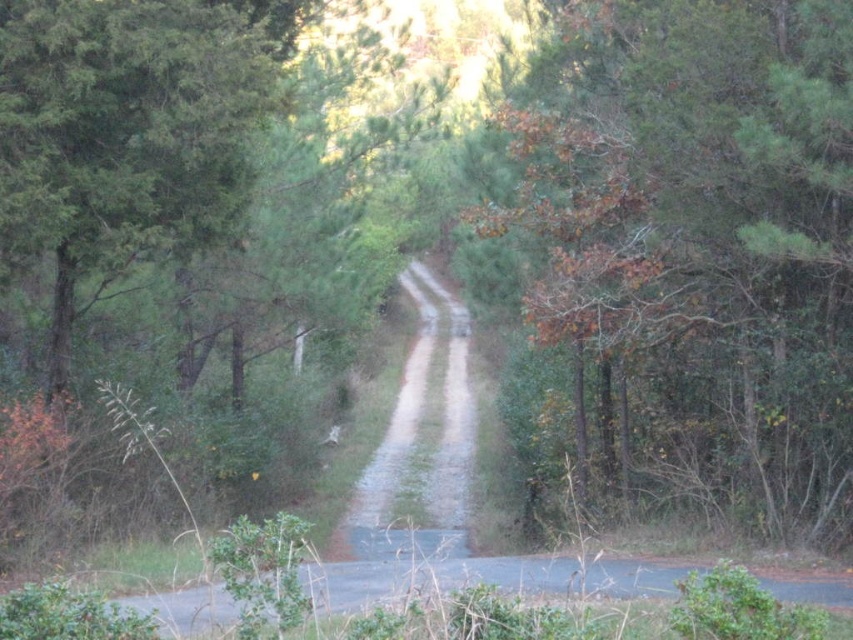
Question: Does brown/dry leaves at upper center lie behind dirt/gravel trail at center?

Choices:
 (A) no
 (B) yes

Answer: (B)

Question: Can you confirm if brown/dry leaves at upper center is smaller than dirt/gravel trail at center?

Choices:
 (A) yes
 (B) no

Answer: (A)

Question: Which object is farther from the camera taking this photo?

Choices:
 (A) dirt/gravel trail at center
 (B) brown/dry leaves at upper center

Answer: (B)

Question: From the image, what is the correct spatial relationship of brown/dry leaves at upper center in relation to dirt/gravel trail at center?

Choices:
 (A) below
 (B) above

Answer: (B)